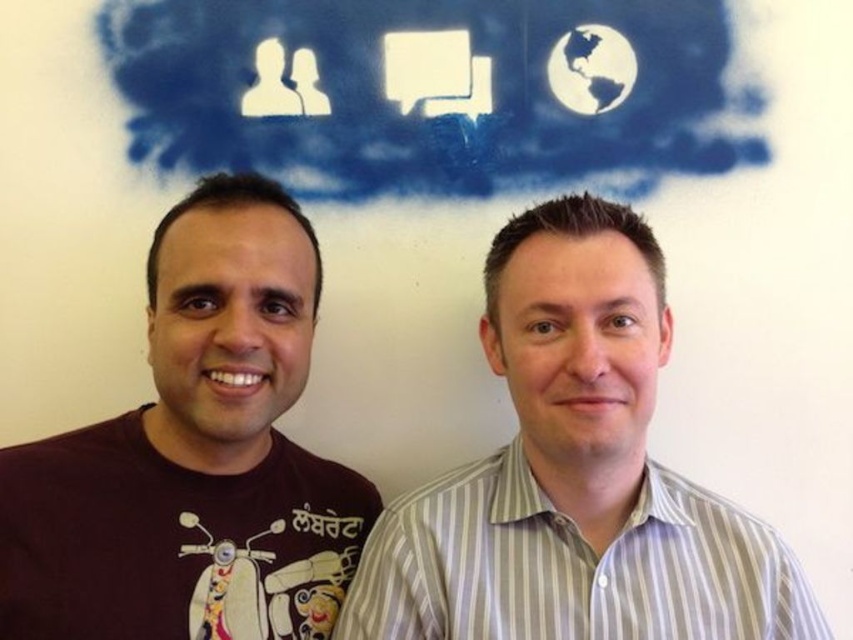
You are a photographer who needs to adjust the lighting for a photo shoot. You have a spotlight that can only illuminate objects to the left of the white striped shirt at center. Will the white paper cloud at upper center be lit by the spotlight?

The white paper cloud at upper center is positioned on the left side of the white striped shirt at center, so it will be lit by the spotlight since it is to the left of the shirt.